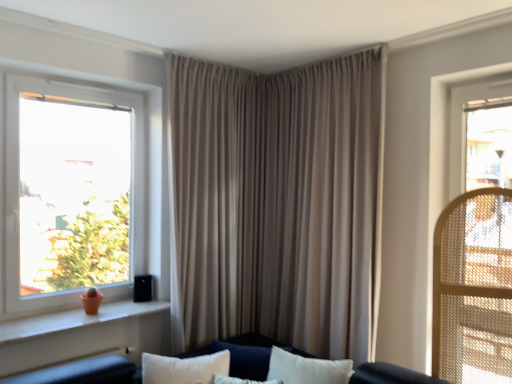
Question: Is velvet dark blue couch at center oriented towards beige fabric curtain at center?

Choices:
 (A) no
 (B) yes

Answer: (A)

Question: Is velvet dark blue couch at center next to beige fabric curtain at center?

Choices:
 (A) no
 (B) yes

Answer: (A)

Question: From the image's perspective, is velvet dark blue couch at center below beige fabric curtain at center?

Choices:
 (A) yes
 (B) no

Answer: (A)

Question: Is velvet dark blue couch at center completely or partially outside of beige fabric curtain at center?

Choices:
 (A) no
 (B) yes

Answer: (B)

Question: Can you confirm if velvet dark blue couch at center is thinner than beige fabric curtain at center?

Choices:
 (A) yes
 (B) no

Answer: (B)

Question: Is beige fabric curtain at center inside velvet dark blue couch at center?

Choices:
 (A) no
 (B) yes

Answer: (A)

Question: Is white plastic window at left to the right of velvet dark blue couch at center from the viewer's perspective?

Choices:
 (A) yes
 (B) no

Answer: (B)

Question: Does white plastic window at left have a larger size compared to velvet dark blue couch at center?

Choices:
 (A) no
 (B) yes

Answer: (A)

Question: Is white plastic window at left oriented towards velvet dark blue couch at center?

Choices:
 (A) yes
 (B) no

Answer: (A)

Question: Is white plastic window at left wider than velvet dark blue couch at center?

Choices:
 (A) yes
 (B) no

Answer: (B)

Question: From the image's perspective, does white plastic window at left appear lower than velvet dark blue couch at center?

Choices:
 (A) yes
 (B) no

Answer: (B)

Question: Is the depth of white plastic window at left less than that of velvet dark blue couch at center?

Choices:
 (A) no
 (B) yes

Answer: (A)

Question: Is beige fabric curtain at center thinner than white plastic window at left?

Choices:
 (A) yes
 (B) no

Answer: (B)